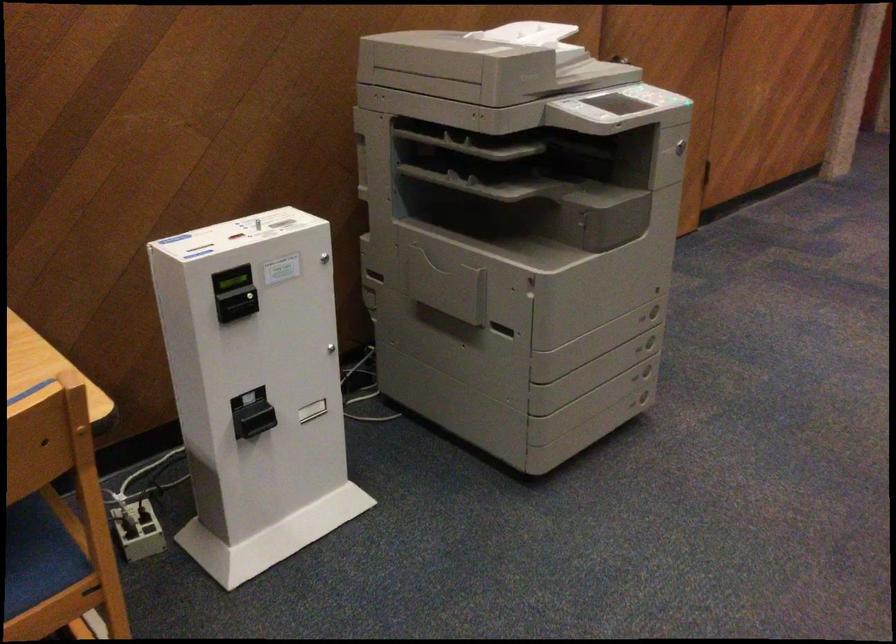
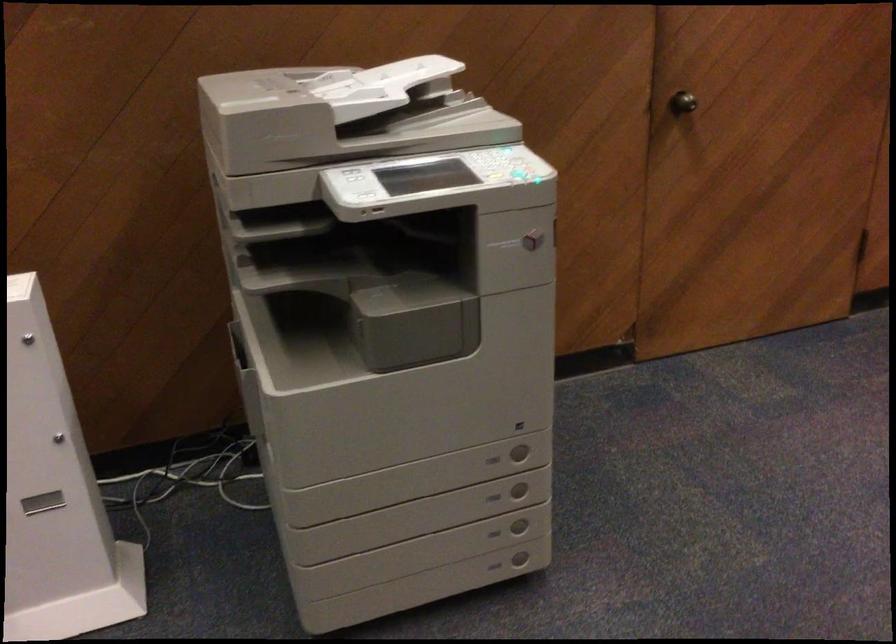
Find the pixel in the second image that matches point (655, 310) in the first image.

(519, 451)